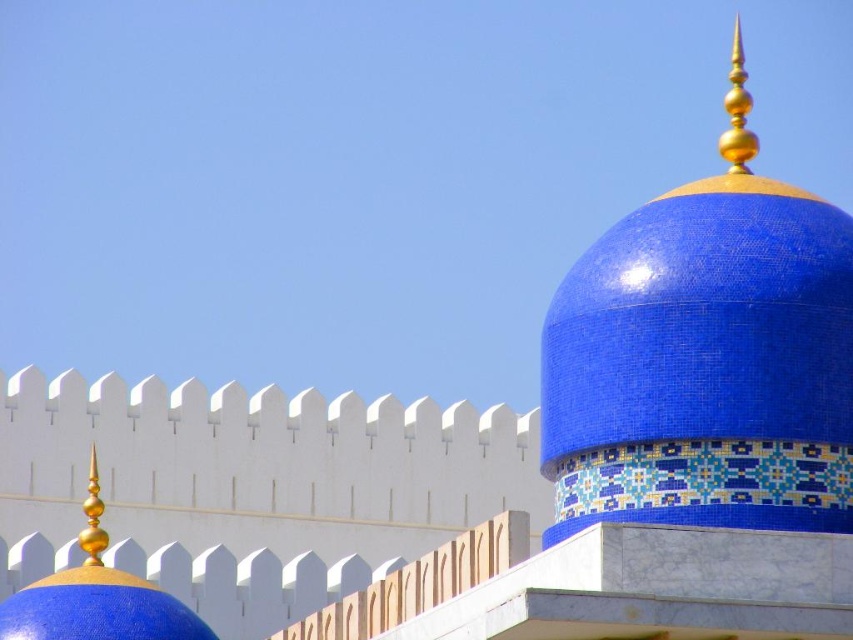
Question: Which of the following is the closest to the observer?

Choices:
 (A) (90, 554)
 (B) (544, 474)

Answer: (B)

Question: Can you confirm if blue mosaic dome at upper right is positioned to the right of shiny gold spire at left?

Choices:
 (A) yes
 (B) no

Answer: (A)

Question: Is blue mosaic dome at upper right positioned at the back of shiny gold spire at left?

Choices:
 (A) yes
 (B) no

Answer: (B)

Question: Which of the following is the farthest from the observer?

Choices:
 (A) shiny gold spire at left
 (B) blue mosaic dome at upper right

Answer: (A)

Question: Is blue mosaic dome at upper right to the left of shiny gold spire at left from the viewer's perspective?

Choices:
 (A) yes
 (B) no

Answer: (B)